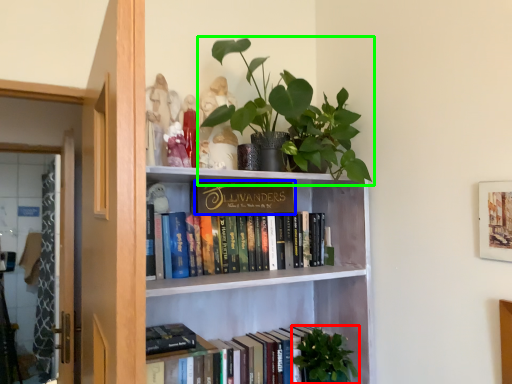
Question: Which is nearer to the vegetation (highlighted by a red box)? paperback book (highlighted by a blue box) or houseplant (highlighted by a green box).

Choices:
 (A) paperback book
 (B) houseplant

Answer: (A)